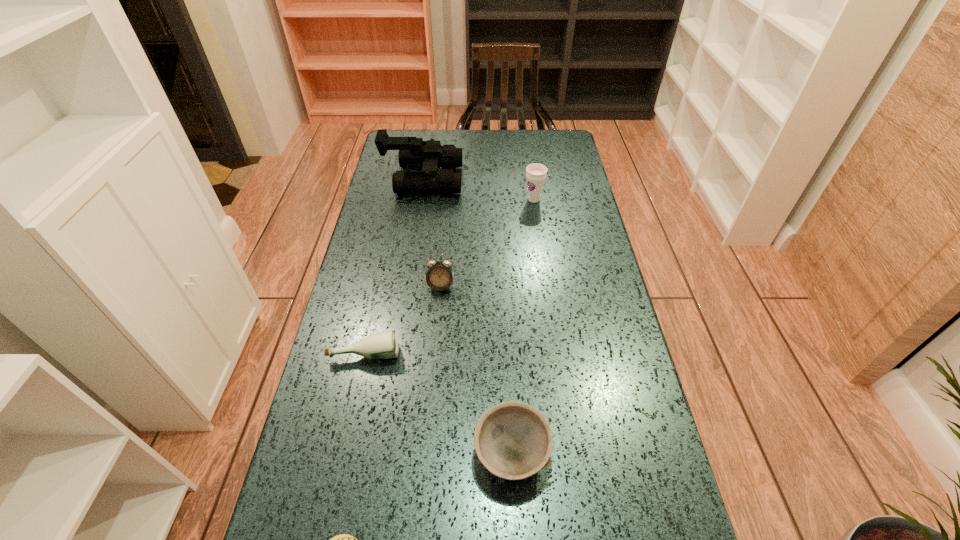
The width and height of the screenshot is (960, 540). Identify the location of vacant space situated on the back of the second tallest object. (528, 158).

This screenshot has height=540, width=960. Identify the location of free space located on the face of the fourth shortest object. coord(436,350).

You are a GUI agent. You are given a task and a screenshot of the screen. Output one action in this format:
    pyautogui.click(x=<x>, y=<y>)
    Task: Click on the vacant space located 0.090m on the left of the second nearest object
    The width and height of the screenshot is (960, 540).
    Given the screenshot: What is the action you would take?
    pyautogui.click(x=432, y=454)

This screenshot has width=960, height=540. Find the location of `free point located on the back of the bottle`. free point located on the back of the bottle is located at coordinates (379, 289).

The width and height of the screenshot is (960, 540). I want to click on binoculars that is at the left edge, so click(x=414, y=153).

I want to click on bottle that is at the left edge, so click(383, 345).

You are a GUI agent. You are given a task and a screenshot of the screen. Output one action in this format:
    pyautogui.click(x=<x>, y=<y>)
    Task: Click on the object that is at the right edge
    Image resolution: width=960 pixels, height=540 pixels.
    Given the screenshot: What is the action you would take?
    pyautogui.click(x=536, y=173)

This screenshot has height=540, width=960. I want to click on free space at the far edge, so click(x=443, y=133).

What are the coordinates of `vacant space at the left edge of the desktop` in the screenshot? It's located at (381, 185).

This screenshot has width=960, height=540. In order to click on free space at the right edge of the desktop in this screenshot , I will do 558,241.